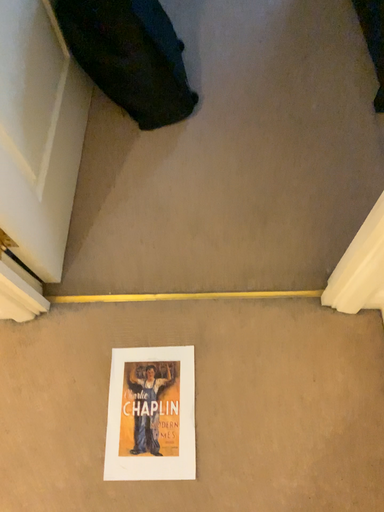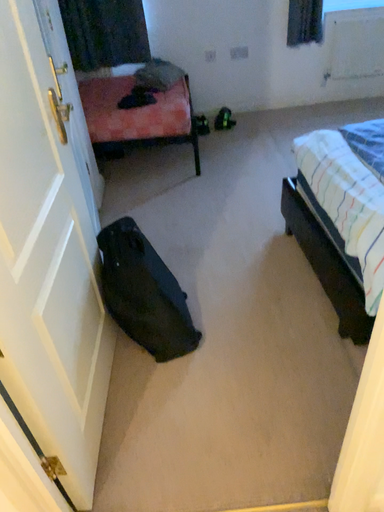
Question: How did the camera likely rotate when shooting the video?

Choices:
 (A) rotated downward
 (B) rotated upward

Answer: (B)